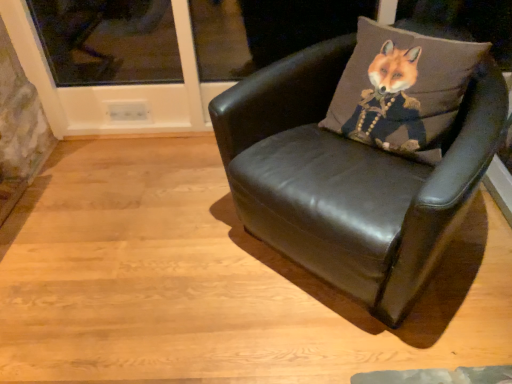
Locate an element on the screen. vacant space situated on the left part of black leather chair at center is located at coordinates (163, 254).